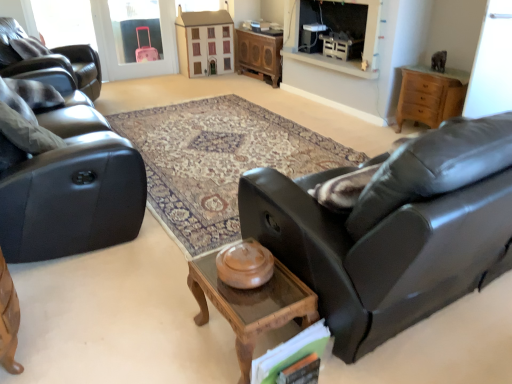
Question: Is matte black recliner at left to the left or to the right of matte brown wooden dresser at upper center in the image?

Choices:
 (A) left
 (B) right

Answer: (A)

Question: Which is correct: matte black recliner at left is inside matte brown wooden dresser at upper center, or outside of it?

Choices:
 (A) inside
 (B) outside

Answer: (B)

Question: Which object is positioned farthest from the matte black recliner at left?

Choices:
 (A) white plastic corded phone at upper center
 (B) matte black couch at right, the first studio couch when ordered from right to left
 (C) matte black couch at left, the 1th studio couch from the left
 (D) matte brown bowl at center
 (E) transparent glass door at upper right

Answer: (E)

Question: Which object is the farthest from the matte black couch at right, marked as the second studio couch in a left-to-right arrangement?

Choices:
 (A) wooden cabinet at center
 (B) white plastic corded phone at upper center
 (C) wooden glass coffee table at center
 (D) matte black recliner at left
 (E) matte black fireplace at upper center

Answer: (A)